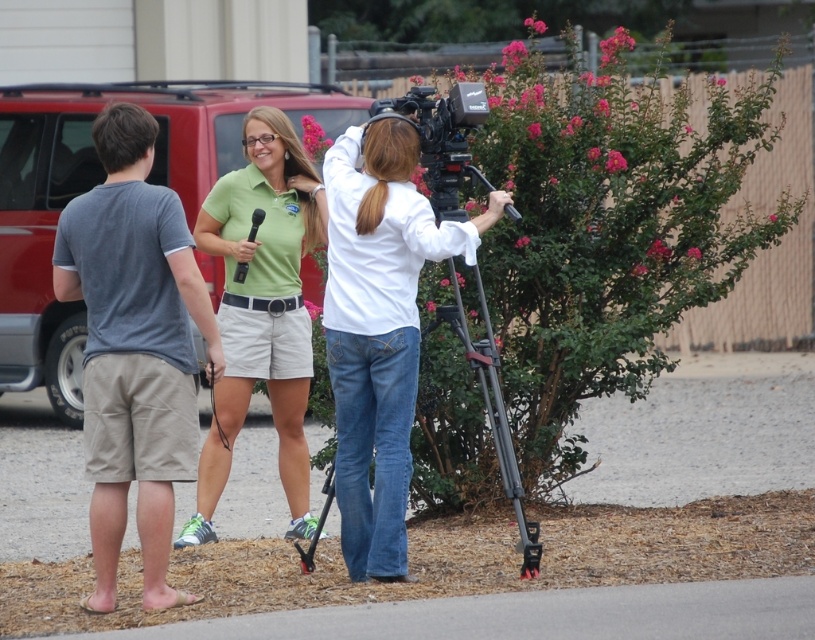
Which of these two, white cotton shirt at center or green matte shorts at center, stands shorter?

white cotton shirt at center is shorter.

Consider the image. Which is below, white cotton shirt at center or green matte shorts at center?

white cotton shirt at center is below.

Does point (404, 269) lie in front of point (212, 497)?

Yes, point (404, 269) is in front of point (212, 497).

Image resolution: width=815 pixels, height=640 pixels. I want to click on white cotton shirt at center, so click(x=379, y=328).

Describe the element at coordinates (134, 348) in the screenshot. I see `gray cotton shorts at left` at that location.

Image resolution: width=815 pixels, height=640 pixels. Find the location of `gray cotton shorts at left`. gray cotton shorts at left is located at coordinates (134, 348).

Who is shorter, gray cotton shorts at left or white cotton shirt at center?

white cotton shirt at center

Who is more distant from viewer, [98,422] or [377,561]?

The point [98,422] is behind.

Locate an element on the screen. gray cotton shorts at left is located at coordinates (134, 348).